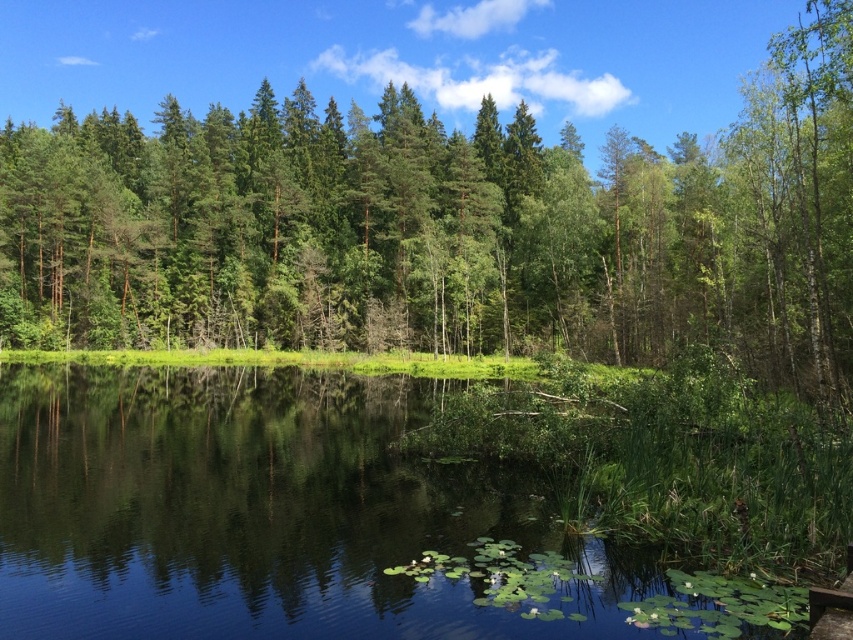
Question: Which object appears farthest from the camera in this image?

Choices:
 (A) green leafy vegetation at lower center
 (B) green leafy tree at center

Answer: (B)

Question: Is green leafy tree at center smaller than green leafy vegetation at lower center?

Choices:
 (A) no
 (B) yes

Answer: (A)

Question: Is green leafy tree at center wider than green leafy vegetation at lower center?

Choices:
 (A) no
 (B) yes

Answer: (B)

Question: Which object appears closest to the camera in this image?

Choices:
 (A) green leafy tree at center
 (B) green leafy vegetation at lower center

Answer: (B)

Question: In this image, where is green leafy tree at center located relative to green leafy vegetation at lower center?

Choices:
 (A) below
 (B) above

Answer: (B)